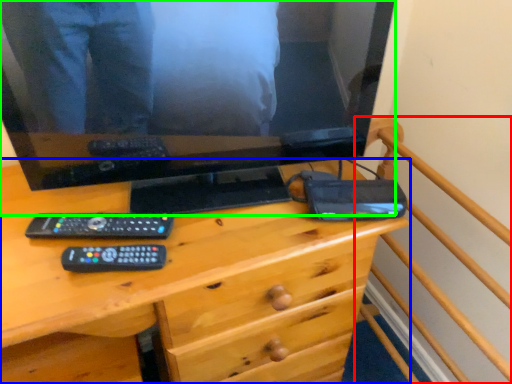
Question: Which object is positioned closest to bed frame (highlighted by a red box)? Select from desk (highlighted by a blue box) and television (highlighted by a green box).

Choices:
 (A) desk
 (B) television

Answer: (A)